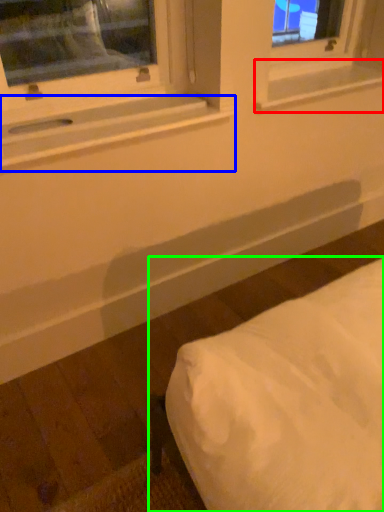
Question: Based on their relative distances, which object is farther from window sill (highlighted by a red box)? Choose from window sill (highlighted by a blue box) and furniture (highlighted by a green box).

Choices:
 (A) window sill
 (B) furniture

Answer: (B)